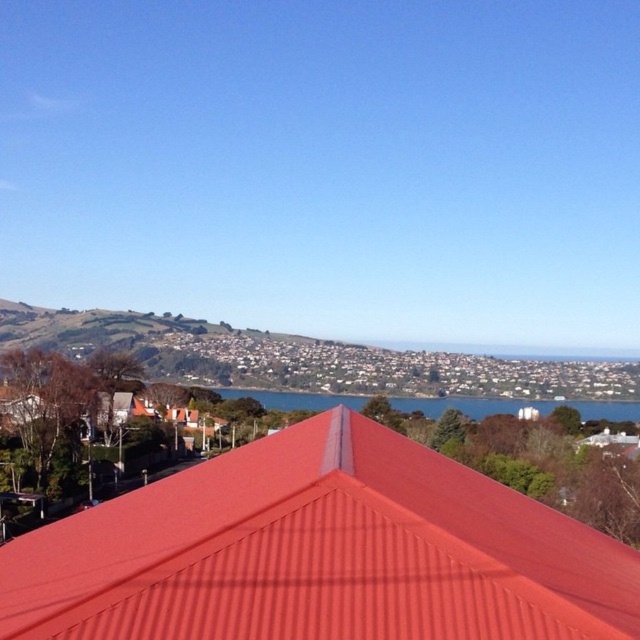
Question: Does metallic red roof at center have a lesser width compared to blue water at center?

Choices:
 (A) yes
 (B) no

Answer: (A)

Question: Does metallic red roof at center come behind blue water at center?

Choices:
 (A) no
 (B) yes

Answer: (A)

Question: Observing the image, what is the correct spatial positioning of metallic red roof at center in reference to blue water at center?

Choices:
 (A) left
 (B) right

Answer: (A)